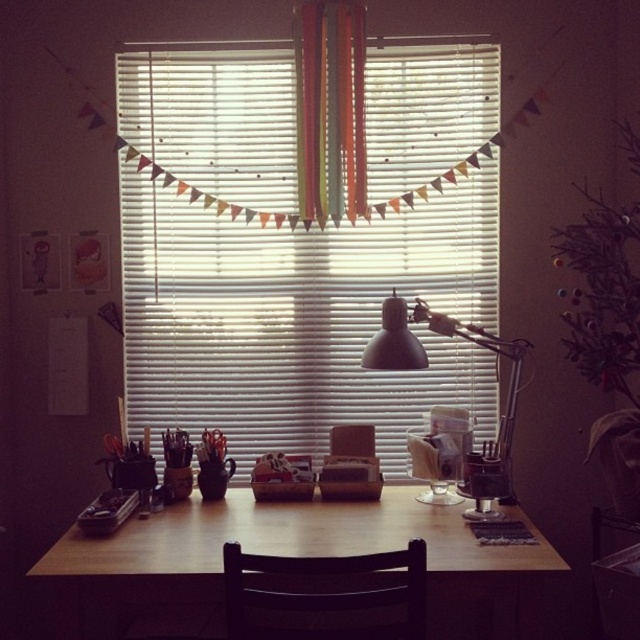
Question: Which of the following is the closest to the observer?

Choices:
 (A) (353, 83)
 (B) (246, 605)

Answer: (B)

Question: Is wooden table at center smaller than matte black lamp at center?

Choices:
 (A) yes
 (B) no

Answer: (B)

Question: Does white blinds at center appear over wooden table at center?

Choices:
 (A) no
 (B) yes

Answer: (B)

Question: Is white blinds at center below wooden table at center?

Choices:
 (A) no
 (B) yes

Answer: (A)

Question: Which of the following is the closest to the observer?

Choices:
 (A) (540, 616)
 (B) (342, 186)
 (C) (324, 627)
 (D) (205, 163)

Answer: (C)

Question: Which point is farther to the camera?

Choices:
 (A) white blinds at center
 (B) wooden table at center

Answer: (A)